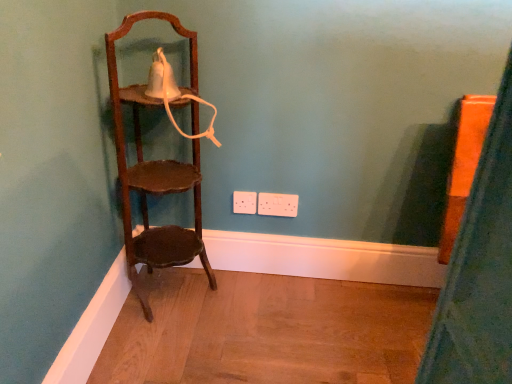
Where is `wooden shelf at left`? The height and width of the screenshot is (384, 512). wooden shelf at left is located at coordinates [156, 170].

Image resolution: width=512 pixels, height=384 pixels. What do you see at coordinates (156, 170) in the screenshot?
I see `wooden shelf at left` at bounding box center [156, 170].

Identify the location of wooden shelf at left. This screenshot has width=512, height=384. (156, 170).